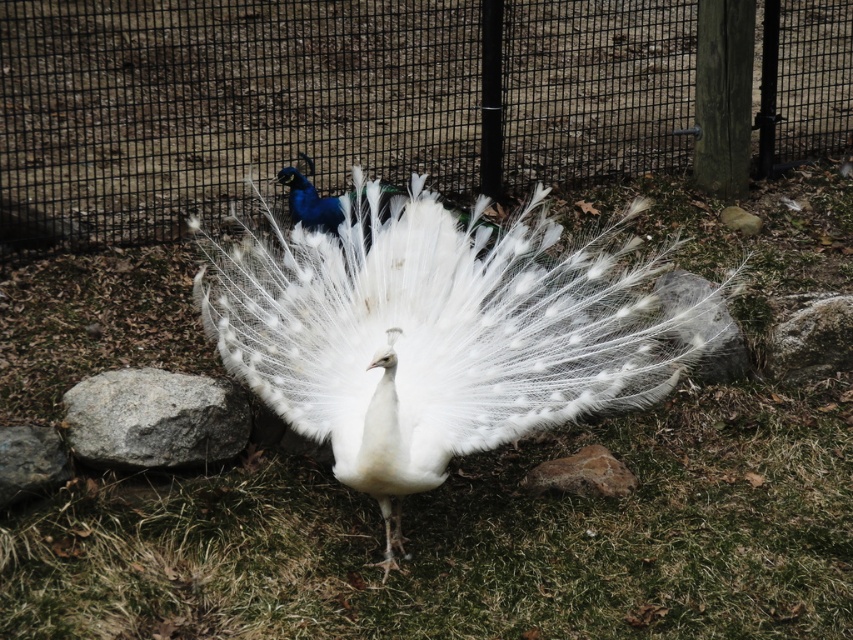
Can you confirm if black mesh fence at center is wider than gray rough rock at lower left?

Yes, black mesh fence at center is wider than gray rough rock at lower left.

Does black mesh fence at center have a lesser height compared to gray rough rock at lower left?

Incorrect, black mesh fence at center's height does not fall short of gray rough rock at lower left's.

Is point (764, 120) more distant than point (103, 461)?

That is True.

Where is `black mesh fence at center`? This screenshot has height=640, width=853. black mesh fence at center is located at coordinates (323, 100).

Based on the photo, can you confirm if gray rough rock at lower left is wider than gray rock at lower left?

Correct, the width of gray rough rock at lower left exceeds that of gray rock at lower left.

Image resolution: width=853 pixels, height=640 pixels. I want to click on gray rough rock at lower left, so [155, 419].

Is black mesh fence at center above white feathered peacock at center?

Yes, black mesh fence at center is above white feathered peacock at center.

Who is lower down, black mesh fence at center or white feathered peacock at center?

white feathered peacock at center

Who is more distant from viewer, (643,147) or (370,214)?

The point (643,147) is behind.

Identify the location of black mesh fence at center. This screenshot has height=640, width=853. (323, 100).